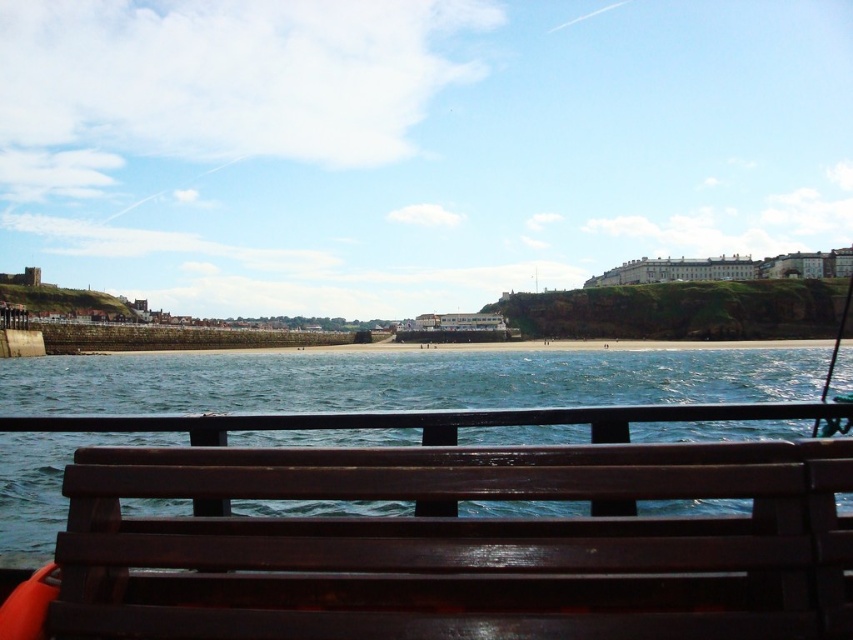
This screenshot has height=640, width=853. What do you see at coordinates (456, 532) in the screenshot? I see `dark wood bench at lower center` at bounding box center [456, 532].

Is dark wood bench at lower center above metallic fishing pole at right?

No.

Describe the element at coordinates (456, 532) in the screenshot. This screenshot has height=640, width=853. I see `dark wood bench at lower center` at that location.

The height and width of the screenshot is (640, 853). Find the location of `dark wood bench at lower center`. dark wood bench at lower center is located at coordinates (456, 532).